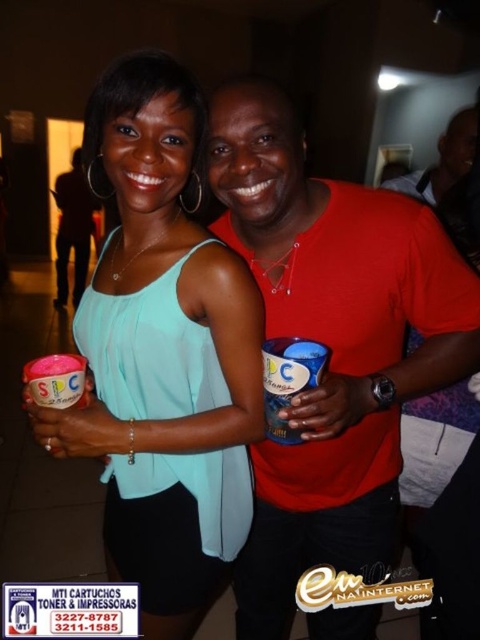
You are at a party and want to grab a drink. You see the blue plastic cup at center and pink matte cup at center. Which cup is positioned higher?

The blue plastic cup at center is located above the pink matte cup at center, so it is positioned higher.

You are a photographer trying to capture a clear shot of the pink matte cup at center and the matte black shirt at center. Which object should you adjust your focus to first to ensure it appears sharp in the final photo?

The matte black shirt at center should be focused on first because the pink matte cup at center is behind it, so adjusting focus starting from the closer object ensures both are in focus.